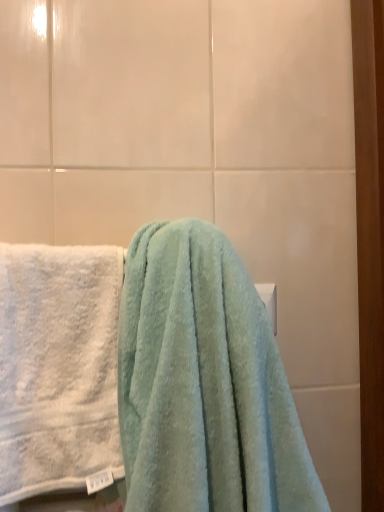
Find the location of a particular element. white matte towel bar at upper center is located at coordinates (269, 301).

The image size is (384, 512). Identify the location of white fluffy towel at left, which is the first towel from left to right. (58, 367).

The image size is (384, 512). I want to click on white matte towel bar at upper center, so click(269, 301).

Is white fluffy towel at left, which is the first towel from left to right, at the back of white matte towel bar at upper center?

No.

Image resolution: width=384 pixels, height=512 pixels. What are the coordinates of `the 1st towel in front of the white matte towel bar at upper center, starting your count from the anchor` in the screenshot? It's located at pos(58,367).

Is soft blue towel at center, the first towel from the right, with white matte towel bar at upper center?

No, soft blue towel at center, the first towel from the right, is not touching white matte towel bar at upper center.

Measure the distance from soft blue towel at center, the 2th towel viewed from the left, to white matte towel bar at upper center.

soft blue towel at center, the 2th towel viewed from the left, is 20.01 centimeters from white matte towel bar at upper center.

From the image's perspective, is soft blue towel at center, the first towel from the right, located above white matte towel bar at upper center?

Result: No.

Consider the image. From a real-world perspective, which object rests below the other?

From a 3D spatial view, soft blue towel at center, the 2th towel viewed from the left, is below.

Does soft blue towel at center, the first towel from the right, lie in front of white fluffy towel at left, which is the first towel from left to right?

Yes, it is in front of white fluffy towel at left, which is the first towel from left to right.

Considering the positions of points (233, 300) and (62, 335), is point (233, 300) closer to camera compared to point (62, 335)?

Yes, point (233, 300) is in front of point (62, 335).

From the image's perspective, would you say soft blue towel at center, the 2th towel viewed from the left, is positioned over white fluffy towel at left, the second towel when ordered from right to left?

Yes, from the image's perspective, soft blue towel at center, the 2th towel viewed from the left, is on top of white fluffy towel at left, the second towel when ordered from right to left.

Is soft blue towel at center, the 2th towel viewed from the left, smaller than white fluffy towel at left, the second towel when ordered from right to left?

Actually, soft blue towel at center, the 2th towel viewed from the left, might be larger than white fluffy towel at left, the second towel when ordered from right to left.

Find the location of a particular element. The width and height of the screenshot is (384, 512). towel bar on the right of soft blue towel at center, the 2th towel viewed from the left is located at coordinates (269, 301).

Consider the image. Is white matte towel bar at upper center facing towards soft blue towel at center, the 2th towel viewed from the left?

Yes, white matte towel bar at upper center is oriented towards soft blue towel at center, the 2th towel viewed from the left.

Is white matte towel bar at upper center further to camera compared to soft blue towel at center, the 2th towel viewed from the left?

Yes, white matte towel bar at upper center is behind soft blue towel at center, the 2th towel viewed from the left.

In the scene shown: Is white matte towel bar at upper center next to soft blue towel at center, the 2th towel viewed from the left?

No, white matte towel bar at upper center is not next to soft blue towel at center, the 2th towel viewed from the left.

Considering the sizes of objects white fluffy towel at left, which is the first towel from left to right, and soft blue towel at center, the 2th towel viewed from the left, in the image provided, who is wider, white fluffy towel at left, which is the first towel from left to right, or soft blue towel at center, the 2th towel viewed from the left,?

soft blue towel at center, the 2th towel viewed from the left, is wider.

Between white fluffy towel at left, which is the first towel from left to right, and soft blue towel at center, the 2th towel viewed from the left, which one appears on the left side from the viewer's perspective?

white fluffy towel at left, which is the first towel from left to right, is more to the left.

From the image's perspective, who appears lower, white fluffy towel at left, the second towel when ordered from right to left, or soft blue towel at center, the first towel from the right?

white fluffy towel at left, the second towel when ordered from right to left, from the image's perspective.

How many degrees apart are the facing directions of white fluffy towel at left, the second towel when ordered from right to left, and soft blue towel at center, the first towel from the right?

0.00172 degrees.

Is white fluffy towel at left, which is the first towel from left to right, situated inside white matte towel bar at upper center or outside?

The correct answer is: outside.

Considering the points (82, 343) and (276, 320), which point is in front, point (82, 343) or point (276, 320)?

The point (82, 343) is more forward.

Where is `towel bar that is behind the white fluffy towel at left, the second towel when ordered from right to left`? The width and height of the screenshot is (384, 512). towel bar that is behind the white fluffy towel at left, the second towel when ordered from right to left is located at coordinates (269, 301).

From the image's perspective, is white fluffy towel at left, which is the first towel from left to right, located above or below white matte towel bar at upper center?

white fluffy towel at left, which is the first towel from left to right, is situated lower than white matte towel bar at upper center in the image.

Where is `towel bar that appears above the white fluffy towel at left, which is the first towel from left to right (from the image's perspective)`? towel bar that appears above the white fluffy towel at left, which is the first towel from left to right (from the image's perspective) is located at coordinates (269, 301).

The width and height of the screenshot is (384, 512). What are the coordinates of `towel bar positioned vertically above the soft blue towel at center, the 2th towel viewed from the left (from a real-world perspective)` in the screenshot? It's located at (269, 301).

Based on their spatial positions, is soft blue towel at center, the 2th towel viewed from the left, or white fluffy towel at left, which is the first towel from left to right, closer to white matte towel bar at upper center?

soft blue towel at center, the 2th towel viewed from the left.

When comparing their distances from soft blue towel at center, the first towel from the right, does white matte towel bar at upper center or white fluffy towel at left, which is the first towel from left to right, seem further?

The object further to soft blue towel at center, the first towel from the right, is white matte towel bar at upper center.

Which object lies further to the anchor point soft blue towel at center, the 2th towel viewed from the left, white fluffy towel at left, which is the first towel from left to right, or white matte towel bar at upper center?

Among the two, white matte towel bar at upper center is located further to soft blue towel at center, the 2th towel viewed from the left.

Looking at the image, which one is located further to white matte towel bar at upper center, white fluffy towel at left, the second towel when ordered from right to left, or soft blue towel at center, the first towel from the right?

Among the two, white fluffy towel at left, the second towel when ordered from right to left, is located further to white matte towel bar at upper center.

Looking at the image, which one is located closer to white fluffy towel at left, which is the first towel from left to right, soft blue towel at center, the first towel from the right, or white matte towel bar at upper center?

The object closer to white fluffy towel at left, which is the first towel from left to right, is soft blue towel at center, the first towel from the right.

From the picture: Considering their positions, is white matte towel bar at upper center positioned further to white fluffy towel at left, the second towel when ordered from right to left, than soft blue towel at center, the 2th towel viewed from the left?

Among the two, white matte towel bar at upper center is located further to white fluffy towel at left, the second towel when ordered from right to left.

This screenshot has width=384, height=512. Identify the location of towel located between white fluffy towel at left, the second towel when ordered from right to left, and white matte towel bar at upper center in the left-right direction. (204, 383).